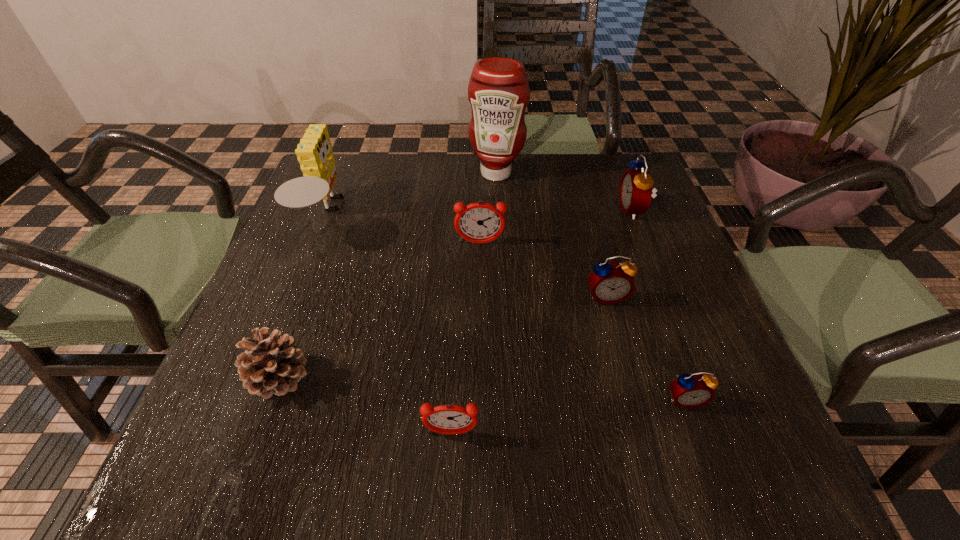
Where is `red condiment`? The image size is (960, 540). red condiment is located at coordinates (498, 91).

At what (x,y) coordinates should I click in order to perform the action: click on the tallest object. Please return your answer as a coordinate pair (x, y). Looking at the image, I should click on tap(498, 91).

Where is `yellow sponge`? The width and height of the screenshot is (960, 540). yellow sponge is located at coordinates (314, 152).

Where is `sponge`? Image resolution: width=960 pixels, height=540 pixels. sponge is located at coordinates (314, 152).

The image size is (960, 540). Find the location of `the farthest red alarm clock`. the farthest red alarm clock is located at coordinates (636, 186).

Where is `the sixth shortest object`? Image resolution: width=960 pixels, height=540 pixels. the sixth shortest object is located at coordinates (636, 186).

Locate an element on the screen. the second farthest alarm clock is located at coordinates (479, 222).

At what (x,y) coordinates should I click in order to perform the action: click on the bigger reddish-pink alarm clock. Please return your answer as a coordinate pair (x, y). The image size is (960, 540). Looking at the image, I should click on (479, 222).

This screenshot has height=540, width=960. What are the coordinates of `the sixth object from left to right` in the screenshot? It's located at 610,283.

Locate an element on the screen. Image resolution: width=960 pixels, height=540 pixels. the fourth nearest object is located at coordinates (610, 283).